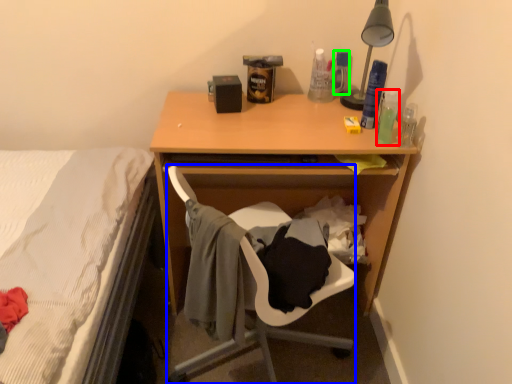
Question: Estimate the real-world distances between objects in this image. Which object is closer to bottle (highlighted by a red box), chair (highlighted by a blue box) or bottle (highlighted by a green box)?

Choices:
 (A) chair
 (B) bottle

Answer: (B)